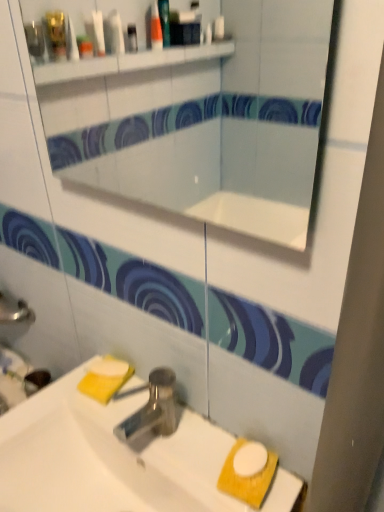
Question: Is the depth of white glossy sink at lower center greater than that of polished metallic tap at center?

Choices:
 (A) yes
 (B) no

Answer: (B)

Question: Does white glossy sink at lower center have a smaller size compared to polished metallic tap at center?

Choices:
 (A) yes
 (B) no

Answer: (B)

Question: Is the position of white glossy sink at lower center less distant than that of polished metallic tap at center?

Choices:
 (A) no
 (B) yes

Answer: (B)

Question: From a real-world perspective, is white glossy sink at lower center over polished metallic tap at center?

Choices:
 (A) no
 (B) yes

Answer: (A)

Question: Is white glossy sink at lower center not within polished metallic tap at center?

Choices:
 (A) no
 (B) yes

Answer: (B)

Question: Is polished metallic tap at center bigger or smaller than white matte soap at lower center?

Choices:
 (A) small
 (B) big

Answer: (B)

Question: Is polished metallic tap at center taller or shorter than white matte soap at lower center?

Choices:
 (A) tall
 (B) short

Answer: (A)

Question: From the image's perspective, is polished metallic tap at center located above or below white matte soap at lower center?

Choices:
 (A) below
 (B) above

Answer: (A)

Question: Would you say polished metallic tap at center is to the left or to the right of white matte soap at lower center in the picture?

Choices:
 (A) left
 (B) right

Answer: (B)

Question: Is point (112, 372) closer or farther from the camera than point (155, 379)?

Choices:
 (A) closer
 (B) farther

Answer: (B)

Question: From the image's perspective, is white matte soap at lower center located above or below polished metallic tap at center?

Choices:
 (A) above
 (B) below

Answer: (A)

Question: In terms of height, does white matte soap at lower center look taller or shorter compared to polished metallic tap at center?

Choices:
 (A) tall
 (B) short

Answer: (B)

Question: Considering their positions, is white matte soap at lower center located in front of or behind polished metallic tap at center?

Choices:
 (A) front
 (B) behind

Answer: (B)

Question: Considering the positions of point (231, 170) and point (170, 403), is point (231, 170) closer or farther from the camera than point (170, 403)?

Choices:
 (A) farther
 (B) closer

Answer: (A)

Question: Is white glossy mirror at upper center bigger or smaller than polished metallic tap at center?

Choices:
 (A) big
 (B) small

Answer: (A)